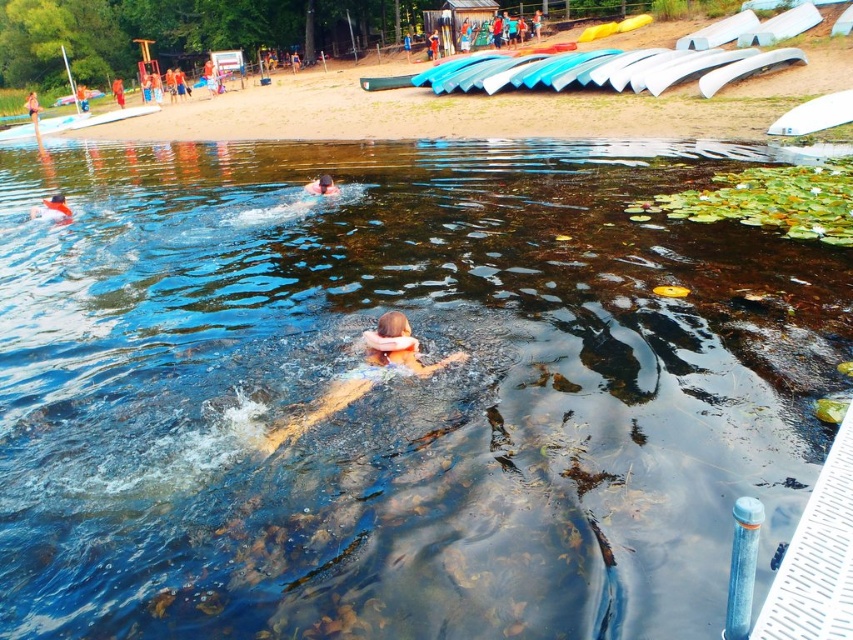
Does point (65, 212) come behind point (322, 177)?

No, it is not.

Can you confirm if matte orange swim cap at lower center is smaller than pink foam at center?

No, matte orange swim cap at lower center is not smaller than pink foam at center.

Which is in front, point (62, 220) or point (323, 173)?

Positioned in front is point (62, 220).

Locate an element on the screen. Image resolution: width=853 pixels, height=640 pixels. matte orange swim cap at lower center is located at coordinates (51, 209).

Describe the element at coordinates (321, 186) in the screenshot. This screenshot has height=640, width=853. I see `pink foam at center` at that location.

Who is more distant from viewer, (332,193) or (120,88)?

The point (120,88) is more distant.

Where is `pink foam at center`? pink foam at center is located at coordinates (321, 186).

Is matte orange swim cap at lower center further to camera compared to orange fabric person at center?

No, matte orange swim cap at lower center is closer to the viewer.

From the picture: Is matte orange swim cap at lower center below orange fabric person at center?

Indeed, matte orange swim cap at lower center is positioned under orange fabric person at center.

In order to click on matte orange swim cap at lower center in this screenshot , I will do [51, 209].

Image resolution: width=853 pixels, height=640 pixels. I want to click on matte orange swim cap at lower center, so [51, 209].